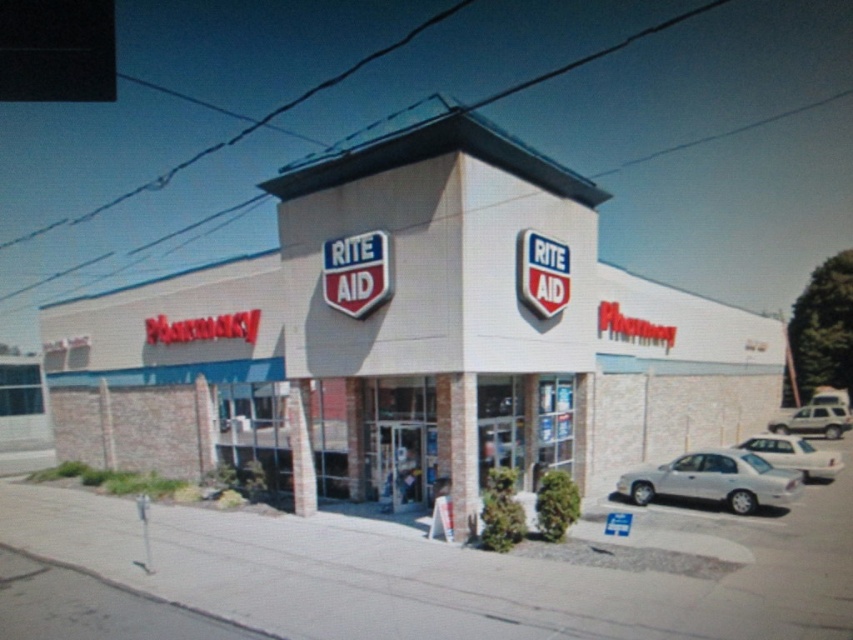
Question: Can you confirm if white matte sedan at lower right is smaller than white matte suv at right?

Choices:
 (A) no
 (B) yes

Answer: (A)

Question: Does white brick building at center have a greater width compared to white matte suv at right?

Choices:
 (A) yes
 (B) no

Answer: (A)

Question: Which of the following is the farthest from the observer?

Choices:
 (A) silver metallic sedan at lower right
 (B) white matte suv at right

Answer: (B)

Question: Based on their relative distances, which object is farther from the white brick building at center?

Choices:
 (A) silver metallic sedan at lower right
 (B) white matte sedan at lower right

Answer: (A)

Question: Estimate the real-world distances between objects in this image. Which object is farther from the white matte suv at right?

Choices:
 (A) white matte sedan at lower right
 (B) white brick building at center
 (C) silver metallic sedan at lower right

Answer: (C)

Question: Is white brick building at center below white matte suv at right?

Choices:
 (A) no
 (B) yes

Answer: (A)